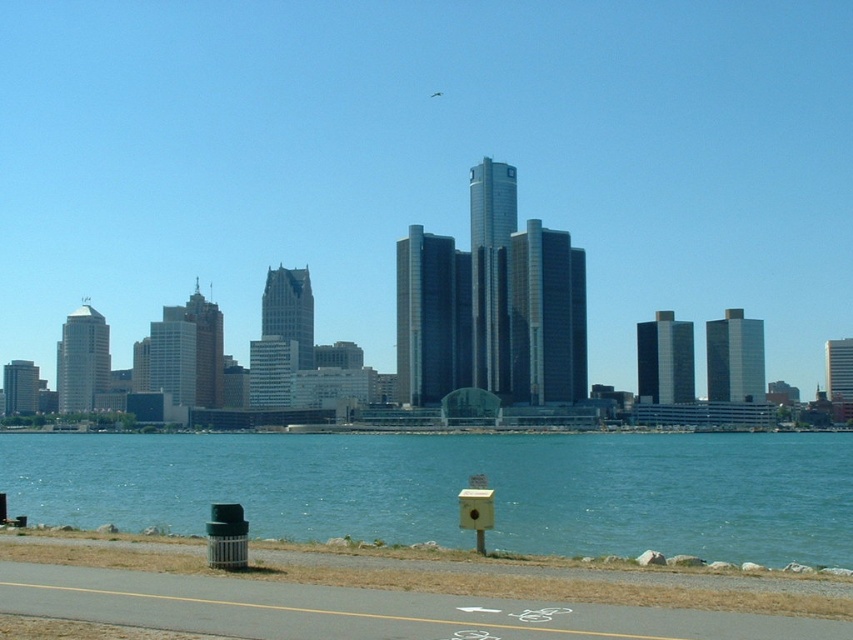
Does blue water at lower center appear on the right side of gray asphalt bike path at lower center?

Indeed, blue water at lower center is positioned on the right side of gray asphalt bike path at lower center.

Who is more distant from viewer, (335, 468) or (250, 586)?

Point (335, 468)

Measure the distance between blue water at lower center and camera.

blue water at lower center is 20.26 meters from camera.

This screenshot has height=640, width=853. I want to click on blue water at lower center, so click(459, 488).